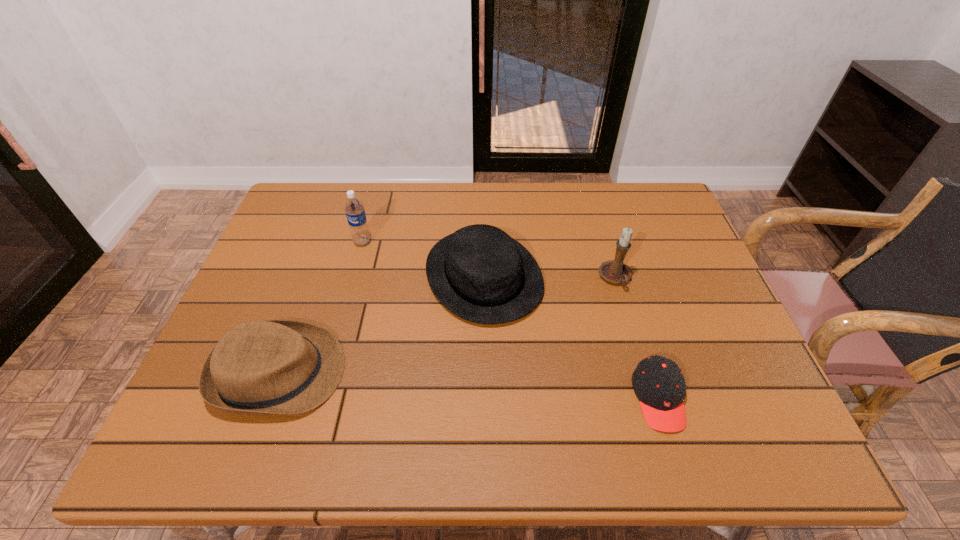
Where is `free space between the farther fedora and the candle holder`? Image resolution: width=960 pixels, height=540 pixels. free space between the farther fedora and the candle holder is located at coordinates (549, 277).

Locate an element on the screen. The width and height of the screenshot is (960, 540). free space between the cap and the left fedora is located at coordinates (469, 386).

Find the location of `vacant space that is in between the farther fedora and the shortest object`. vacant space that is in between the farther fedora and the shortest object is located at coordinates (571, 337).

Locate an element on the screen. This screenshot has width=960, height=540. empty space that is in between the cap and the left fedora is located at coordinates (469, 386).

You are a GUI agent. You are given a task and a screenshot of the screen. Output one action in this format:
    pyautogui.click(x=<x>, y=<y>)
    Task: Click on the free space between the cap and the third object from left to right
    
    Given the screenshot: What is the action you would take?
    pyautogui.click(x=571, y=337)

Where is `empty space that is in between the shortest object and the farther fedora`? Image resolution: width=960 pixels, height=540 pixels. empty space that is in between the shortest object and the farther fedora is located at coordinates (571, 337).

The image size is (960, 540). Find the location of `free area in between the farther fedora and the nearer fedora`. free area in between the farther fedora and the nearer fedora is located at coordinates (382, 324).

Choose which object is the second nearest neighbor to the candle holder. Please provide its 2D coordinates. Your answer should be formatted as a tuple, i.e. [(x, y)], where the tuple contains the x and y coordinates of a point satisfying the conditions above.

[(658, 382)]

Identify which object is located as the second nearest to the candle holder. Please provide its 2D coordinates. Your answer should be formatted as a tuple, i.e. [(x, y)], where the tuple contains the x and y coordinates of a point satisfying the conditions above.

[(658, 382)]